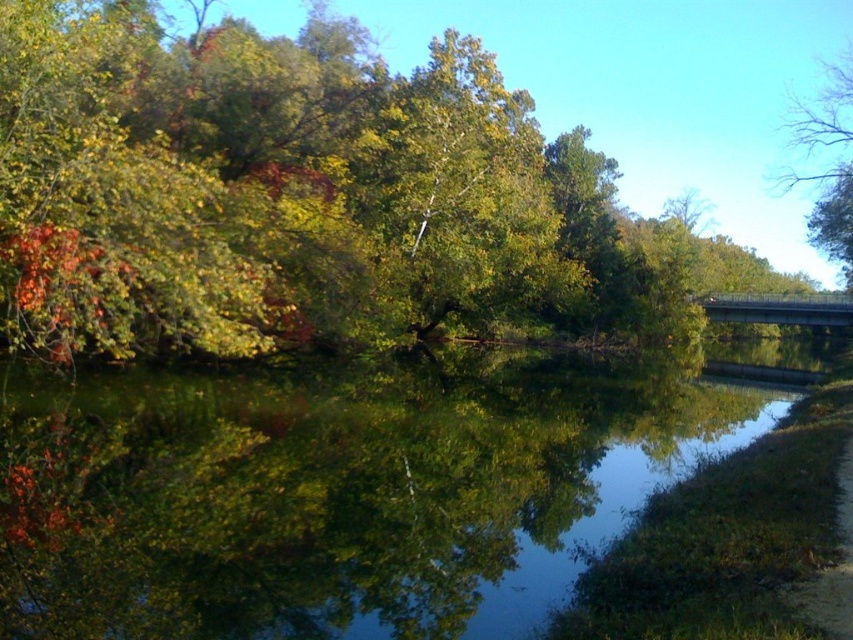
You are planning to install a small boat dock between the green leafy tree at upper center and the bare branches at upper right. The dock requires a minimum of 100 feet of space between the two landmarks for safe passage. Based on the scene description, can the dock be safely installed?

The green leafy tree at upper center is 101.07 feet from the bare branches at upper right, which exceeds the minimum required distance of 100 feet. Therefore, the dock can be safely installed between them.

You are standing at the point marked by the coordinate point at point (x=289, y=193). Looking around, which object in the scene is directly in front of you?

The green leafy tree at upper center is represented by point (x=289, y=193), so standing at that point, the green leafy tree at upper center is directly in front of you.

You are standing on the bridge and want to take a photo of the green reflective water at center and the bare branches at upper right. Which object should you point your camera towards first if you want to capture both in a single frame?

You should point your camera towards the green reflective water at center first because it is located to the left of the bare branches at upper right, allowing both to be included in the frame when positioned correctly.